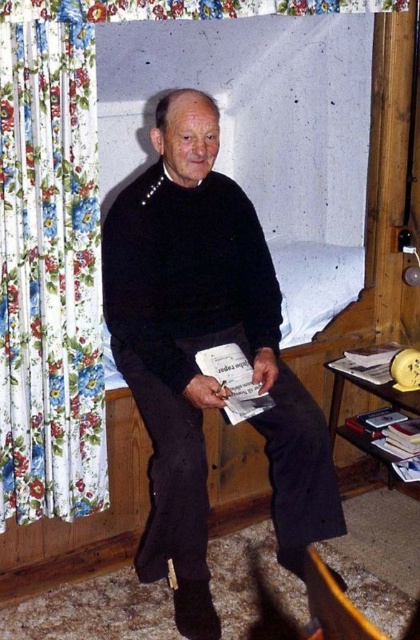
Is floral fabric curtain at left taller than orange fabric armchair at lower right?

Indeed, floral fabric curtain at left has a greater height compared to orange fabric armchair at lower right.

Between point (18, 304) and point (330, 595), which one is positioned behind?

Positioned behind is point (18, 304).

Which is behind, point (16, 113) or point (333, 595)?

Point (16, 113)

Image resolution: width=420 pixels, height=640 pixels. Identify the location of floral fabric curtain at left. (49, 266).

Is black matte sweater at center wider than orange fabric armchair at lower right?

Yes.

Who is more distant from viewer, [178,572] or [323,579]?

Point [178,572]

Identify the location of black matte sweater at center. (204, 348).

Is floral fabric curtain at left wider than white paper book at center?

Yes.

Does floral fabric curtain at left come in front of white paper book at center?

Yes, it is.

Is point (2, 65) farther from viewer compared to point (251, 394)?

No, (2, 65) is closer to viewer.

Find the location of a particular element. The height and width of the screenshot is (640, 420). floral fabric curtain at left is located at coordinates (49, 266).